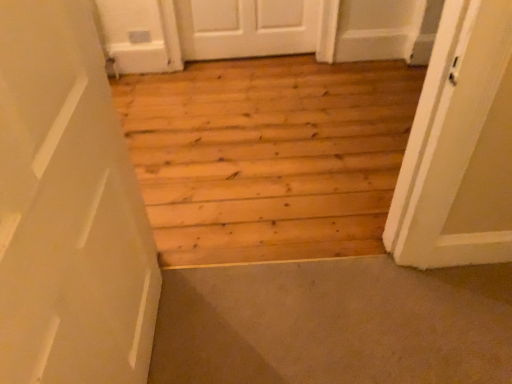
This screenshot has width=512, height=384. What do you see at coordinates (334, 324) in the screenshot? I see `carpeted stairwell at lower left` at bounding box center [334, 324].

Locate an element on the screen. The height and width of the screenshot is (384, 512). carpeted stairwell at lower left is located at coordinates (334, 324).

You are a GUI agent. You are given a task and a screenshot of the screen. Output one action in this format:
    pyautogui.click(x=<x>, y=<y>)
    Task: Click on the carpeted stairwell at lower left
    This screenshot has width=512, height=384.
    Given the screenshot: What is the action you would take?
    [x=334, y=324]